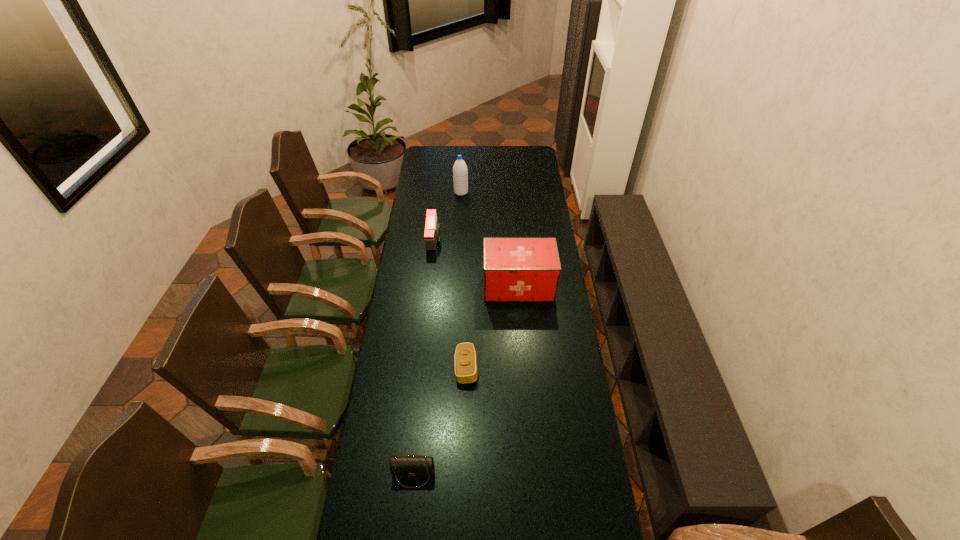
This screenshot has width=960, height=540. I want to click on vacant area at the left edge of the desktop, so click(427, 273).

Locate an element on the screen. This screenshot has width=960, height=540. vacant space at the right edge of the desktop is located at coordinates (599, 493).

Locate an element on the screen. The image size is (960, 540). vacant point at the far left corner is located at coordinates (439, 165).

The image size is (960, 540). Find the location of `vacant region at the far right corner of the desktop`. vacant region at the far right corner of the desktop is located at coordinates (541, 165).

The width and height of the screenshot is (960, 540). I want to click on free space between the second farthest object and the fourth shortest object, so click(476, 263).

This screenshot has width=960, height=540. I want to click on blank region between the farthest object and the second nearest object, so click(x=464, y=280).

The height and width of the screenshot is (540, 960). I want to click on free point between the water bottle and the right clutch bag, so click(464, 280).

Locate an element on the screen. free area in between the second farthest object and the right clutch bag is located at coordinates (450, 304).

The height and width of the screenshot is (540, 960). I want to click on empty space that is in between the farther clutch bag and the farthest object, so (x=464, y=280).

Locate an element on the screen. free space that is in between the second farthest object and the fourth shortest object is located at coordinates (476, 263).